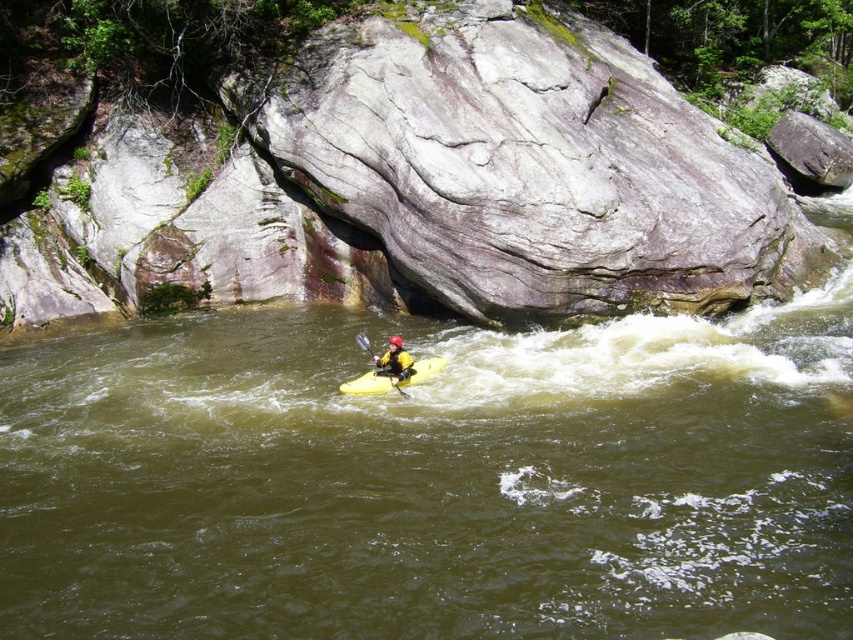
You are a photographer trying to capture the kayaker and the surrounding rocks. You want to ensure that both the gray rough rock at center and the yellow plastic paddle at center are clearly visible in your shot. Based on their sizes, which object should you focus on to ensure it fits within the frame?

The gray rough rock at center is wider than the yellow plastic paddle at center, so you should focus on capturing the gray rough rock at center first to ensure it fits within the frame.

You are a photographer trying to capture the kayaker in the river. You have two points marked on your viewfinder at coordinates point (601, 385) and point (366, 348). Which point is closer to you?

Point (601, 385) is closer to the viewer than point (366, 348).

You are a photographer trying to capture the kayaker and the surrounding environment. Given that the gray rough rock at center and the yellow plastic paddle at center are both in the center of the image, which object would appear bigger in your photo?

The gray rough rock at center appears bigger in the photo because it has a larger size compared to the yellow plastic paddle at center.